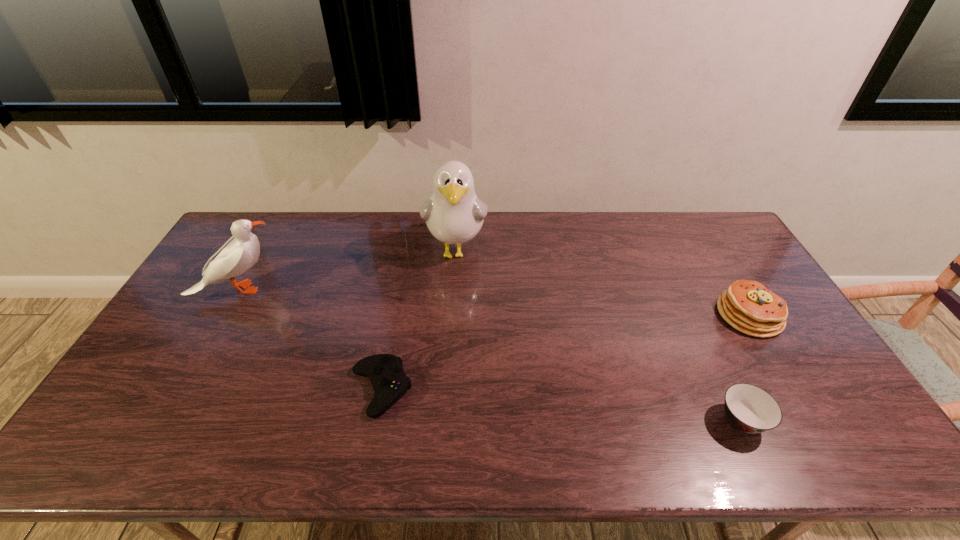
Identify the location of vacant space located 0.090m at the beak of the shorter gull. (308, 289).

The height and width of the screenshot is (540, 960). In order to click on vacant space located 0.360m on the front of the pancake in this screenshot , I will do `click(837, 462)`.

This screenshot has width=960, height=540. What are the coordinates of `vacant position located on the left of the soup bowl` in the screenshot? It's located at (599, 421).

I want to click on free space located on the back of the control, so [x=394, y=321].

In order to click on object present at the far edge in this screenshot , I will do `click(454, 214)`.

Locate an element on the screen. Image resolution: width=960 pixels, height=540 pixels. object at the near edge is located at coordinates (749, 408).

Locate an element on the screen. object present at the left edge is located at coordinates (242, 250).

What are the coordinates of `object located at the right edge` in the screenshot? It's located at (748, 306).

I want to click on vacant point at the far edge, so (x=330, y=244).

Identify the location of free space at the near edge of the desktop. 283,444.